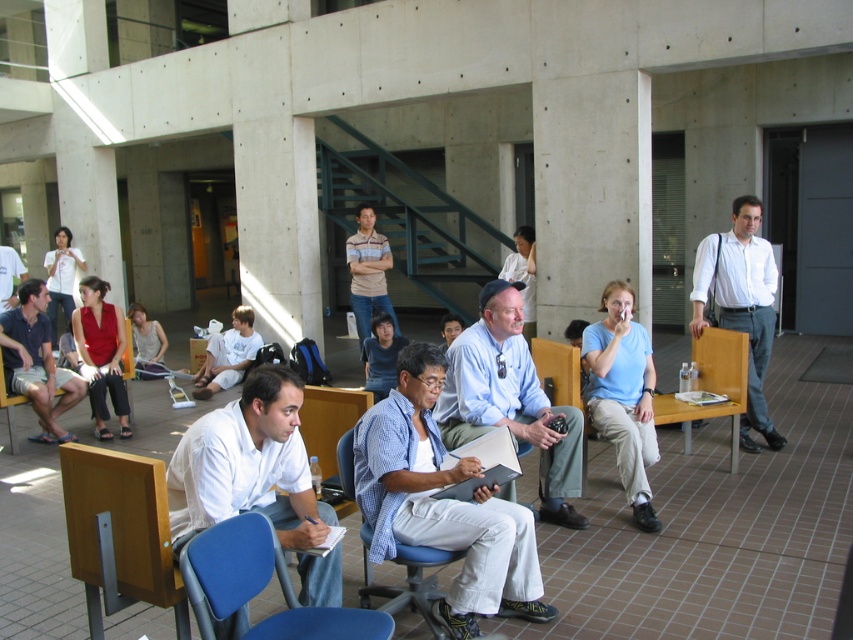
From the picture: You are a person who is 6 feet tall and standing in the middle of the room. You want to move from the blue fabric chair at lower center to the blue fabric chair at center without stepping on the tiles between them. Can you do it by jumping? The maximum horizontal distance you can jump is 24 inches.

The distance between the blue fabric chair at lower center and the blue fabric chair at center is 25.98 inches. Since your maximum jump distance is 24 inches, you cannot jump the gap between them without stepping on the tiles.